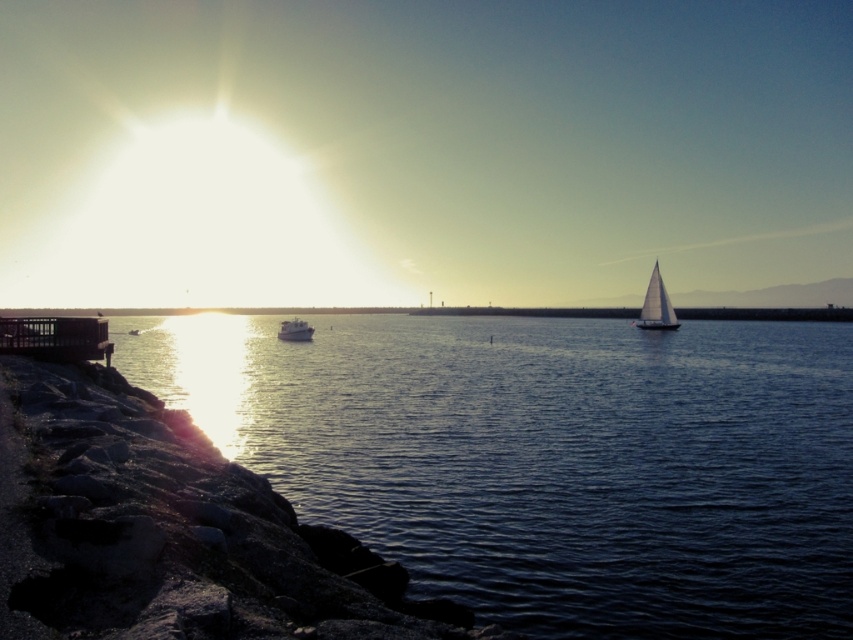
You are standing at the point with coordinates point (x=306, y=330) and want to walk towards the point with coordinates point (x=647, y=316). Given the scene described, will you be walking towards the sun or away from it?

Since point (x=647, y=316) is behind point (x=306, y=330) and the sun is on the left side of the frame, walking towards point (x=647, y=316) would mean moving away from the sun.

You are standing on the rocky shoreline and want to board the white sailboat at right and the metallic silver boat at center. Which boat will you reach first if you walk straight towards them?

You will reach the white sailboat at right first because it is closer to you than the metallic silver boat at center.

You are a marine biologist planning to swim from the metallic silver boat at center to the white sailboat at right. Given that your swimming speed is 2 meters per minute, how many minutes will it take you to reach the destination?

The distance between the white sailboat at right and metallic silver boat at center is 142.99 feet. Converting feet to meters, 142.99 feet is approximately 43.6 meters. At a swimming speed of 2 meters per minute, it would take about 21.8 minutes to reach the destination.